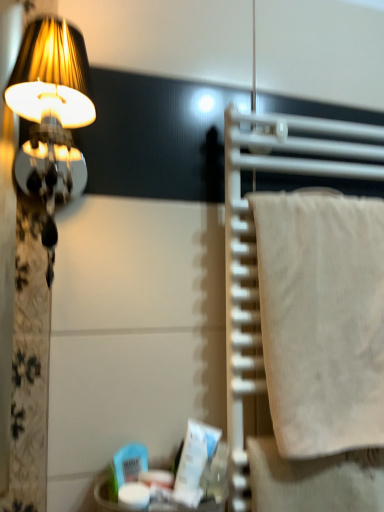
What do you see at coordinates (51, 114) in the screenshot?
I see `matte gold lampshade at left` at bounding box center [51, 114].

You are a GUI agent. You are given a task and a screenshot of the screen. Output one action in this format:
    pyautogui.click(x=<x>, y=<y>)
    Task: Click on the matte gold lampshade at left
    
    Given the screenshot: What is the action you would take?
    pyautogui.click(x=51, y=114)

Describe the element at coordinates (322, 319) in the screenshot. This screenshot has height=512, width=384. I see `white cotton towel at right` at that location.

You are a GUI agent. You are given a task and a screenshot of the screen. Output one action in this format:
    pyautogui.click(x=<x>, y=<y>)
    Task: Click on the white cotton towel at right
    This screenshot has height=512, width=384.
    Given the screenshot: What is the action you would take?
    pyautogui.click(x=322, y=319)

In order to click on matte gold lampshade at left in this screenshot , I will do `click(51, 114)`.

Is white cotton towel at right at the right side of matte gold lampshade at left?

Correct, you'll find white cotton towel at right to the right of matte gold lampshade at left.

Is white cotton towel at right closer to the viewer compared to matte gold lampshade at left?

No, it is not.

Which is closer to the camera, (304, 283) or (57, 56)?

Point (304, 283) appears to be farther away from the viewer than point (57, 56).

From the image's perspective, is white cotton towel at right located above or below matte gold lampshade at left?

Based on their image positions, white cotton towel at right is located beneath matte gold lampshade at left.

From a real-world perspective, is white cotton towel at right positioned under matte gold lampshade at left based on gravity?

Yes, from a real-world perspective, white cotton towel at right is under matte gold lampshade at left.

Can you confirm if white cotton towel at right is thinner than matte gold lampshade at left?

Correct, the width of white cotton towel at right is less than that of matte gold lampshade at left.

Which of these two, white cotton towel at right or matte gold lampshade at left, stands shorter?

matte gold lampshade at left.

Considering the sizes of white cotton towel at right and matte gold lampshade at left in the image, is white cotton towel at right bigger or smaller than matte gold lampshade at left?

Considering their sizes, white cotton towel at right takes up more space than matte gold lampshade at left.

Is white cotton towel at right positioned beyond the bounds of matte gold lampshade at left?

That's correct, white cotton towel at right is outside of matte gold lampshade at left.

In the scene shown: Is white cotton towel at right with matte gold lampshade at left?

No, white cotton towel at right is not next to matte gold lampshade at left.

Does white cotton towel at right turn towards matte gold lampshade at left?

No, white cotton towel at right is not oriented towards matte gold lampshade at left.

Where is `lamp lying on the left of white cotton towel at right`? This screenshot has width=384, height=512. lamp lying on the left of white cotton towel at right is located at coordinates (51, 114).

Between matte gold lampshade at left and white cotton towel at right, which one appears on the left side from the viewer's perspective?

Positioned to the left is matte gold lampshade at left.

Is matte gold lampshade at left further to the viewer compared to white cotton towel at right?

That is False.

Does point (70, 30) appear closer or farther from the camera than point (377, 209)?

Point (70, 30).

From the image's perspective, relative to white cotton towel at right, is matte gold lampshade at left above or below?

matte gold lampshade at left is above white cotton towel at right.

From a real-world perspective, is matte gold lampshade at left beneath white cotton towel at right?

No.

Consider the image. Does matte gold lampshade at left have a lesser width compared to white cotton towel at right?

No, matte gold lampshade at left is not thinner than white cotton towel at right.

Can you confirm if matte gold lampshade at left is taller than white cotton towel at right?

No.

Between matte gold lampshade at left and white cotton towel at right, which one has larger size?

white cotton towel at right.

Is matte gold lampshade at left spatially inside white cotton towel at right, or outside of it?

matte gold lampshade at left is not inside white cotton towel at right, it's outside.

Is matte gold lampshade at left directly adjacent to white cotton towel at right?

No, matte gold lampshade at left is not touching white cotton towel at right.

Is matte gold lampshade at left oriented towards white cotton towel at right?

No, matte gold lampshade at left is not aimed at white cotton towel at right.

Can you tell me how much matte gold lampshade at left and white cotton towel at right differ in facing direction?

0.159 degrees separate the facing orientations of matte gold lampshade at left and white cotton towel at right.

Find the location of a particular element. lamp above the white cotton towel at right (from a real-world perspective) is located at coordinates (51, 114).

The width and height of the screenshot is (384, 512). In order to click on wrap on the right of matte gold lampshade at left in this screenshot , I will do `click(322, 319)`.

The width and height of the screenshot is (384, 512). In the image, there is a white cotton towel at right. Find the location of `lamp above it (from the image's perspective)`. lamp above it (from the image's perspective) is located at coordinates (51, 114).